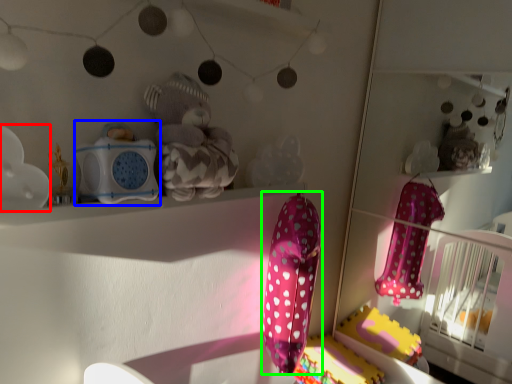
Question: Which object is positioned farthest from toy (highlighted by a red box)? Select from toy (highlighted by a blue box) and baby clothe (highlighted by a green box).

Choices:
 (A) toy
 (B) baby clothe

Answer: (B)